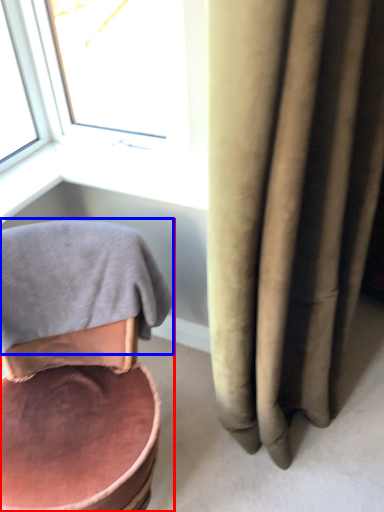
Question: Among these objects, which one is nearest to the camera, chair (highlighted by a red box) or bath towel (highlighted by a blue box)?

Choices:
 (A) chair
 (B) bath towel

Answer: (A)